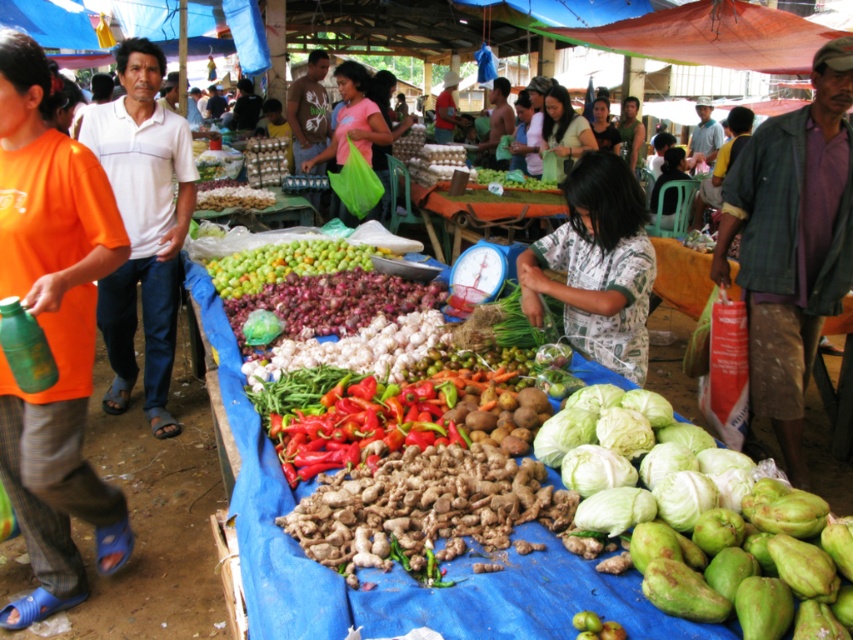
You are a shopper standing at the entrance of the market. You see two points marked in the scene. The first point is at coordinate point (77, 579) and the second point is at coordinate point (315, 161). Which of these two points is closer to your current position?

Point (77, 579) is closer to your current position because it is in front of point (315, 161).

Based on the coordinates provided, what is the color of the fabric shirt located at point [51,332]?

The orange fabric shirt at left is located at point [51,332].